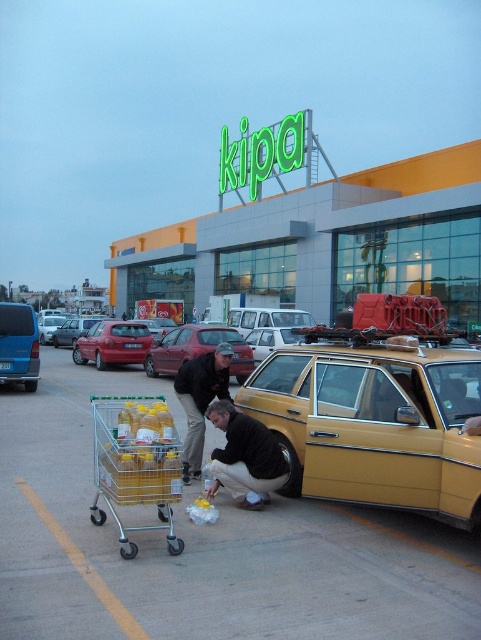
You are a delivery person who needs to park your vehicle between the metallic red car at left and the matte silver sedan at center. Given that your delivery van is 2 meters wide, can you fit it there without touching either car?

The metallic red car at left is wider than the matte silver sedan at center. To determine if your van can fit, calculate the distance between them. If the space between the two cars is at least 2 meters plus the width of your van, then yes. However, since we don not have exact measurements, it is uncertain. Please check the actual space available.